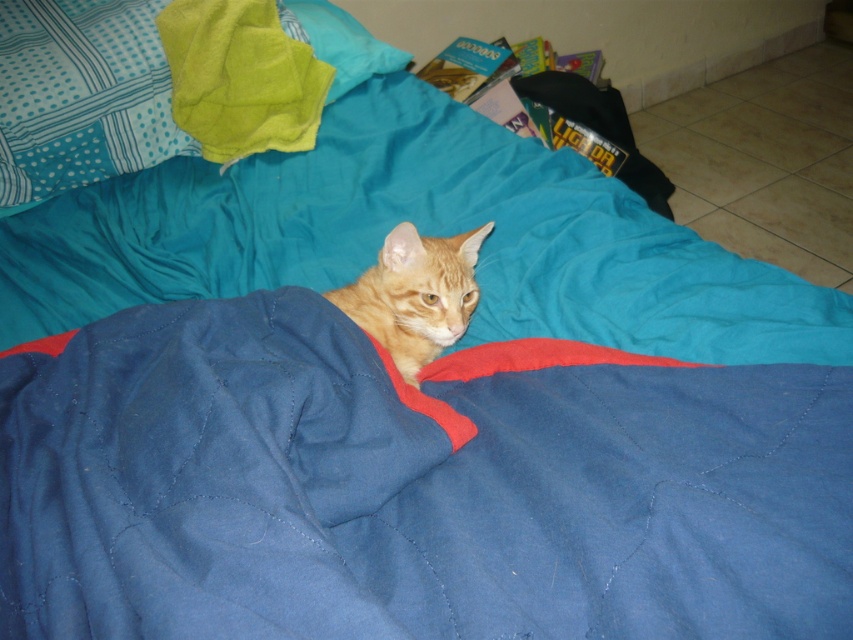
Between blue quilted bedsheet at center and orange fur cat at center, which one appears on the right side from the viewer's perspective?

orange fur cat at center

Between point (508, 189) and point (451, 259), which one is positioned in front?

Point (451, 259) is in front.

You are a GUI agent. You are given a task and a screenshot of the screen. Output one action in this format:
    pyautogui.click(x=<x>, y=<y>)
    Task: Click on the blue quilted bedsheet at center
    This screenshot has width=853, height=640.
    Given the screenshot: What is the action you would take?
    pyautogui.click(x=421, y=232)